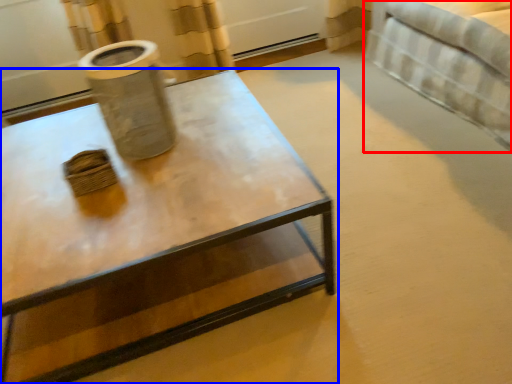
Question: Which point is closer to the camera, bed (highlighted by a red box) or coffee table (highlighted by a blue box)?

Choices:
 (A) bed
 (B) coffee table

Answer: (B)